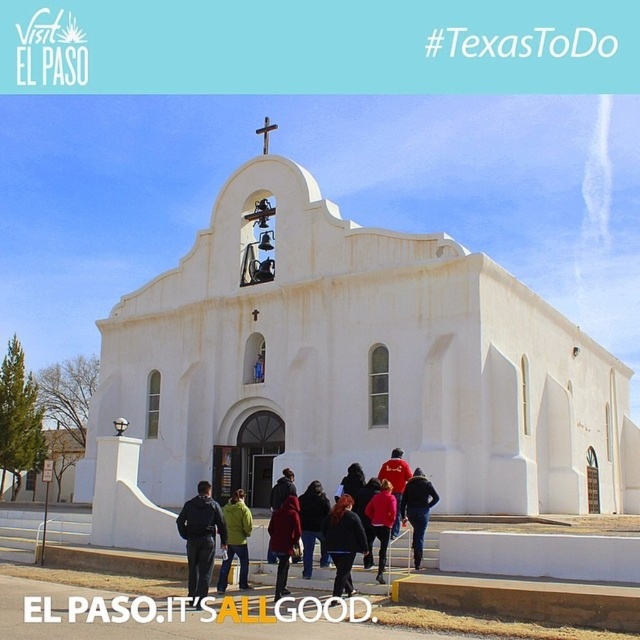
You are standing at the entrance of the historic white church and notice a point marked at coordinates (200, 538). Based on the scene description, can you identify what object this point is located on?

The point at coordinates (200, 538) is located on the black fabric jacket at center.

You are standing at the base of the historic white church and want to walk towards the entrance. There are two points marked on the path in front of you. The first point is at coordinate point (209, 538) and the second is at coordinate point (221, 586). Which point should you step on first to reach the entrance?

You should step on point (209, 538) first because it is in front of point (221, 586), so stepping on the first point will lead you closer to the entrance.